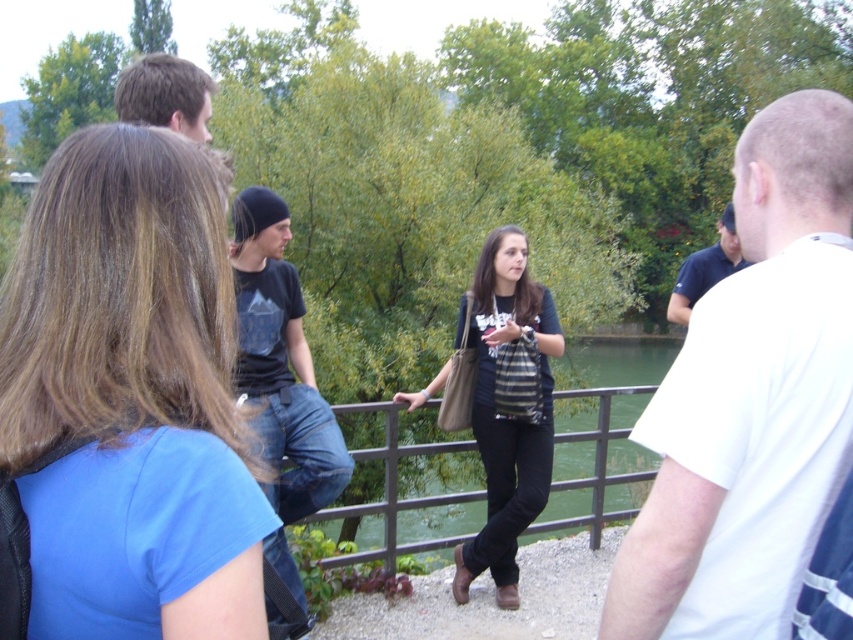
You are a photographer trying to capture a group photo of the blue fabric shirt at left and the black cotton shirt at upper left. Which person should you move closer to the center to ensure both are in frame?

The blue fabric shirt at left should be moved closer to the center because it is thinner than the black cotton shirt at upper left, so it requires less space to fit within the frame.

You are standing at the point with coordinates point (x=514, y=301) and want to walk towards the point (x=395, y=516). Which direction should you move relative to the camera?

You should move away from the camera because point (x=395, y=516) is farther from the camera than point (x=514, y=301).

You are standing at point (x=131, y=396) in the image. What color clothing is closest to you?

The blue fabric shirt at left is located at point (x=131, y=396), so the closest clothing to you is the blue fabric shirt at left.